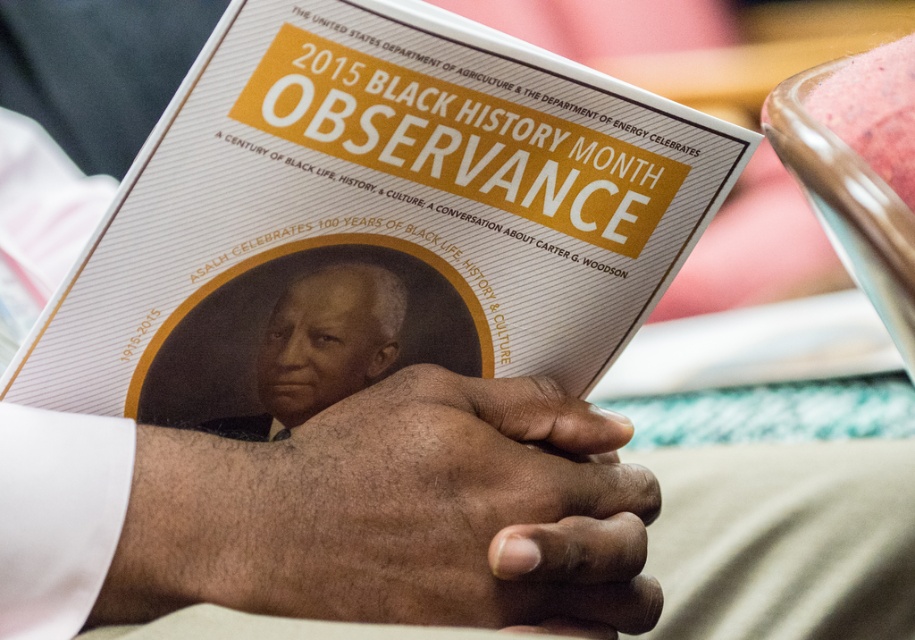
Question: Which is farther from the smooth black portrait at center?

Choices:
 (A) dark skin/hairy hands at center
 (B) matte paper booklet at center

Answer: (A)

Question: Can you confirm if matte paper booklet at center is positioned below smooth black portrait at center?

Choices:
 (A) yes
 (B) no

Answer: (B)

Question: Does dark skin/hairy hands at center appear under smooth black portrait at center?

Choices:
 (A) yes
 (B) no

Answer: (A)

Question: Which object appears closest to the camera in this image?

Choices:
 (A) dark skin/hairy hands at center
 (B) smooth black portrait at center
 (C) matte paper booklet at center

Answer: (A)

Question: Does dark skin/hairy hands at center have a lesser width compared to smooth black portrait at center?

Choices:
 (A) yes
 (B) no

Answer: (B)

Question: Estimate the real-world distances between objects in this image. Which object is farther from the smooth black portrait at center?

Choices:
 (A) dark skin/hairy hands at center
 (B) matte paper booklet at center

Answer: (A)